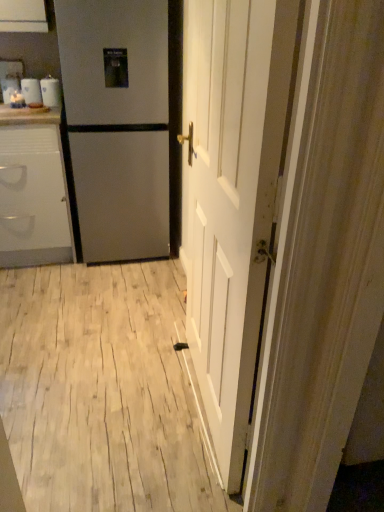
Question: Does white wood floor at center come behind white glossy mugs at upper left?

Choices:
 (A) no
 (B) yes

Answer: (A)

Question: From a real-world perspective, is white wood floor at center below white glossy mugs at upper left?

Choices:
 (A) yes
 (B) no

Answer: (A)

Question: Considering the relative sizes of white wood floor at center and white glossy mugs at upper left in the image provided, is white wood floor at center thinner than white glossy mugs at upper left?

Choices:
 (A) no
 (B) yes

Answer: (A)

Question: Is white wood floor at center turned away from white glossy mugs at upper left?

Choices:
 (A) no
 (B) yes

Answer: (A)

Question: Are white wood floor at center and white glossy mugs at upper left located far from each other?

Choices:
 (A) no
 (B) yes

Answer: (B)

Question: Can we say white wood floor at center lies outside white glossy mugs at upper left?

Choices:
 (A) no
 (B) yes

Answer: (B)

Question: Would you say white glossy cabinet at left is outside white glossy counter top at upper left?

Choices:
 (A) no
 (B) yes

Answer: (B)

Question: Does white glossy cabinet at left touch white glossy counter top at upper left?

Choices:
 (A) yes
 (B) no

Answer: (B)

Question: Considering the relative sizes of white glossy cabinet at left and white glossy counter top at upper left in the image provided, is white glossy cabinet at left smaller than white glossy counter top at upper left?

Choices:
 (A) yes
 (B) no

Answer: (B)

Question: Is white glossy cabinet at left to the right of white glossy counter top at upper left from the viewer's perspective?

Choices:
 (A) yes
 (B) no

Answer: (B)

Question: Can you confirm if white glossy cabinet at left is taller than white glossy counter top at upper left?

Choices:
 (A) no
 (B) yes

Answer: (B)

Question: Considering the relative positions of white glossy cabinet at left and white glossy counter top at upper left in the image provided, is white glossy cabinet at left in front of white glossy counter top at upper left?

Choices:
 (A) no
 (B) yes

Answer: (B)

Question: Can you confirm if satin silver refrigerator at left is shorter than white glossy mugs at upper left?

Choices:
 (A) yes
 (B) no

Answer: (B)